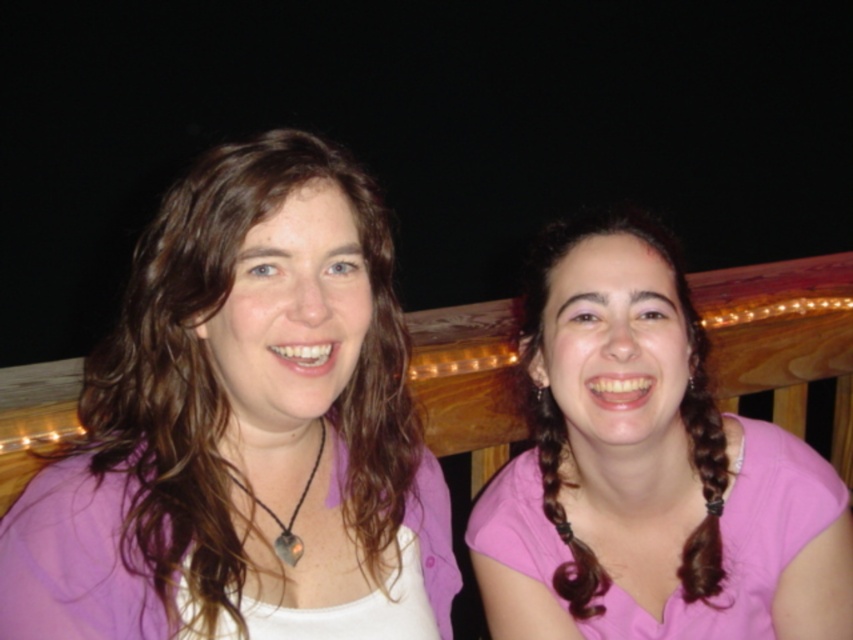
Between matte purple shirt at center and pink matte shirt at right, which one has more height?

matte purple shirt at center

Is matte purple shirt at center above pink matte shirt at right?

Yes.

Where is `matte purple shirt at center`? This screenshot has width=853, height=640. matte purple shirt at center is located at coordinates (242, 429).